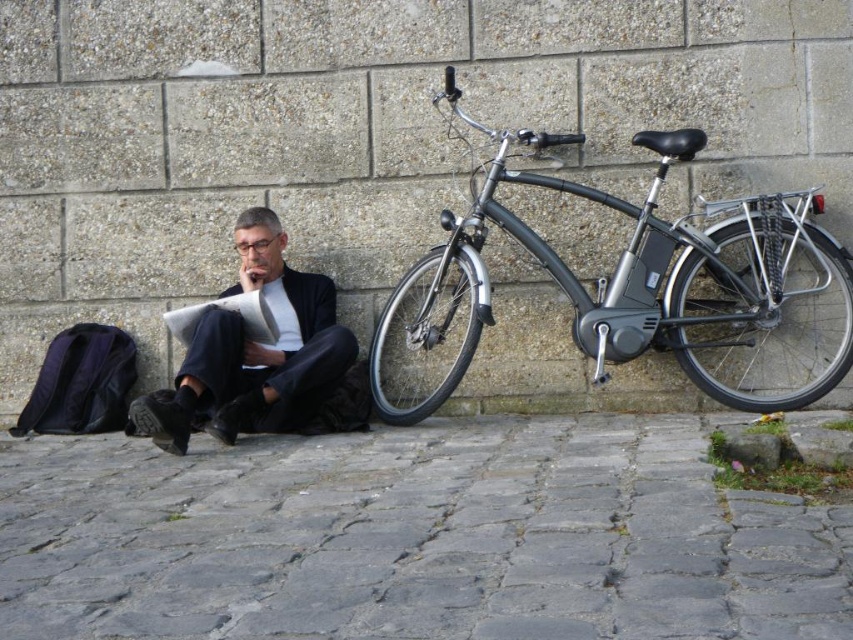
Question: Does shiny metallic bicycle at right appear over black fabric suit at center?

Choices:
 (A) no
 (B) yes

Answer: (B)

Question: Among these points, which one is nearest to the camera?

Choices:
 (A) (207, 348)
 (B) (786, 324)

Answer: (A)

Question: Is gray stone pavement at lower center to the right of black fabric suit at center from the viewer's perspective?

Choices:
 (A) no
 (B) yes

Answer: (B)

Question: Which object is the closest to the gray stone pavement at lower center?

Choices:
 (A) black fabric suit at center
 (B) shiny metallic bicycle at right

Answer: (A)

Question: Is shiny metallic bicycle at right to the right of black fabric suit at center from the viewer's perspective?

Choices:
 (A) yes
 (B) no

Answer: (A)

Question: Which point is closer to the camera?

Choices:
 (A) shiny metallic bicycle at right
 (B) gray stone pavement at lower center
 (C) black fabric suit at center

Answer: (B)